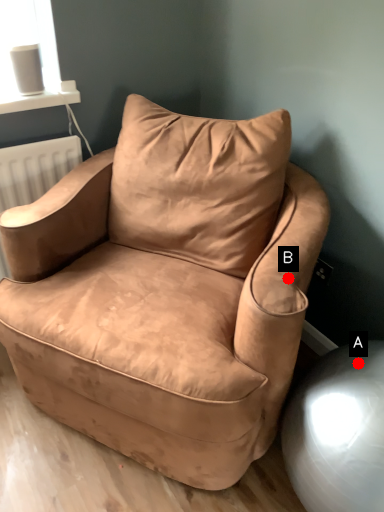
Question: Two points are circled on the image, labeled by A and B beside each circle. Which point is farther to the camera?

Choices:
 (A) A is further
 (B) B is further

Answer: (B)